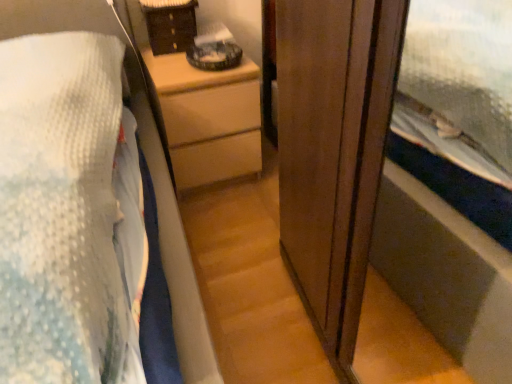
Question: Based on their sizes in the image, would you say brown woven basket at upper center is bigger or smaller than wooden chest of drawers at center?

Choices:
 (A) big
 (B) small

Answer: (B)

Question: From a real-world perspective, is brown woven basket at upper center positioned above or below wooden chest of drawers at center?

Choices:
 (A) below
 (B) above

Answer: (B)

Question: From the image's perspective, is brown woven basket at upper center above or below wooden chest of drawers at center?

Choices:
 (A) below
 (B) above

Answer: (B)

Question: Is wooden chest of drawers at center situated inside brown woven basket at upper center or outside?

Choices:
 (A) inside
 (B) outside

Answer: (B)

Question: From the image's perspective, is wooden chest of drawers at center located above or below brown woven basket at upper center?

Choices:
 (A) below
 (B) above

Answer: (A)

Question: From their relative heights in the image, would you say wooden chest of drawers at center is taller or shorter than brown woven basket at upper center?

Choices:
 (A) short
 (B) tall

Answer: (B)

Question: In the image, is wooden chest of drawers at center on the left side or the right side of brown woven basket at upper center?

Choices:
 (A) left
 (B) right

Answer: (B)